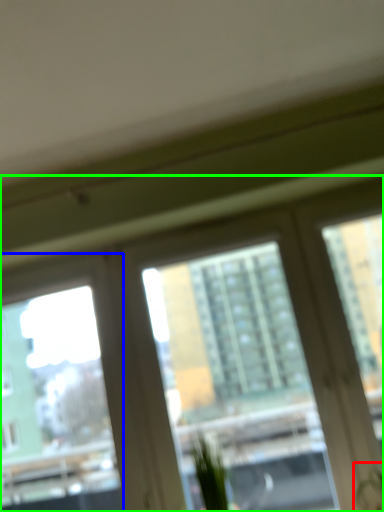
Question: Based on their relative distances, which object is farther from plant (highlighted by a red box)? Choose from window screen (highlighted by a blue box) and window (highlighted by a green box).

Choices:
 (A) window screen
 (B) window

Answer: (A)